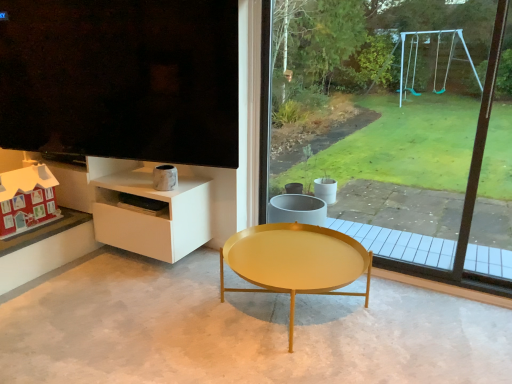
The image size is (512, 384). I want to click on vacant region in front of white glossy shelf at lower left, so click(x=132, y=284).